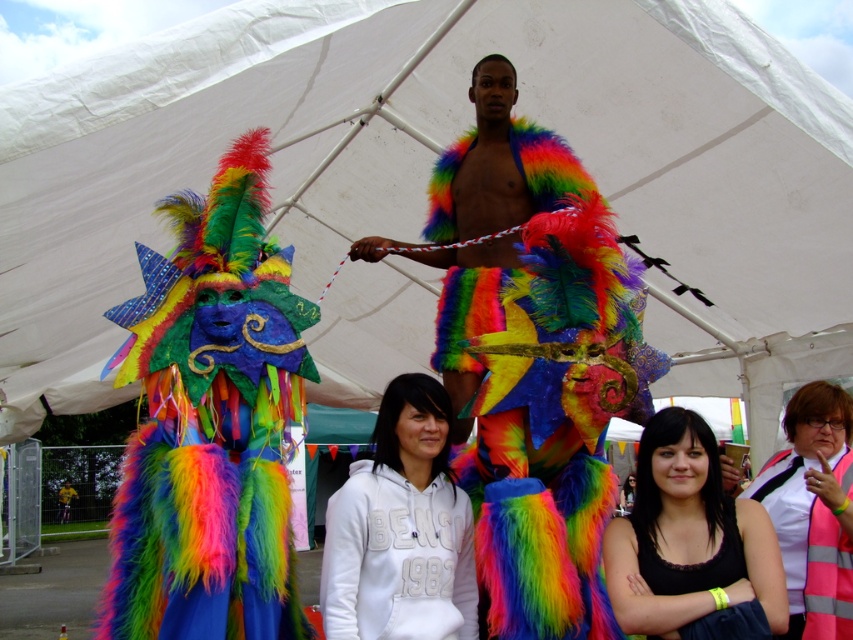
Does multicolored furry costume at left have a smaller size compared to black matte tank top at lower center?

Incorrect, multicolored furry costume at left is not smaller in size than black matte tank top at lower center.

Who is positioned more to the left, multicolored furry costume at left or black matte tank top at lower center?

multicolored furry costume at left

Who is more distant from viewer, [171,452] or [724,515]?

Point [724,515]

This screenshot has width=853, height=640. I want to click on multicolored furry costume at left, so click(210, 422).

Does white fleece hoodie at center lie in front of reflective silver vest at lower right?

Yes.

Who is taller, white fleece hoodie at center or reflective silver vest at lower right?

reflective silver vest at lower right is taller.

Which is behind, point (357, 596) or point (848, 608)?

Point (848, 608)

You are a GUI agent. You are given a task and a screenshot of the screen. Output one action in this format:
    pyautogui.click(x=<x>, y=<y>)
    Task: Click on the white fleece hoodie at center
    The image size is (853, 640).
    Given the screenshot: What is the action you would take?
    pyautogui.click(x=401, y=529)

Which is in front, point (535, 461) or point (724, 564)?

Point (724, 564)

Is rainbow fluffy costume at center shorter than black matte tank top at lower center?

Incorrect, rainbow fluffy costume at center's height does not fall short of black matte tank top at lower center's.

Is point (544, 314) farther from camera compared to point (730, 564)?

Yes, it is.

Find the location of a particular element. rainbow fluffy costume at center is located at coordinates (532, 362).